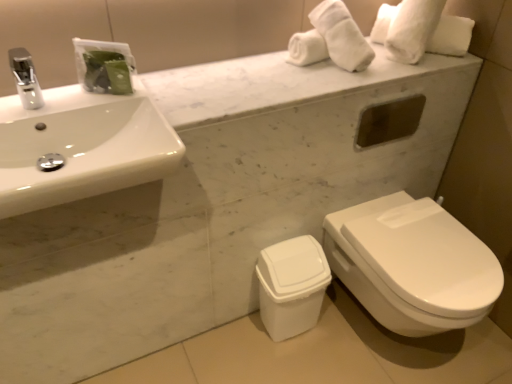
Question: Can you confirm if white glossy sink at upper left is bigger than silver metallic faucet at upper left?

Choices:
 (A) yes
 (B) no

Answer: (A)

Question: Does white glossy sink at upper left turn towards silver metallic faucet at upper left?

Choices:
 (A) no
 (B) yes

Answer: (A)

Question: Would you say white glossy sink at upper left is outside silver metallic faucet at upper left?

Choices:
 (A) yes
 (B) no

Answer: (A)

Question: Is white glossy sink at upper left further to camera compared to silver metallic faucet at upper left?

Choices:
 (A) yes
 (B) no

Answer: (B)

Question: From the image's perspective, is white glossy sink at upper left above silver metallic faucet at upper left?

Choices:
 (A) yes
 (B) no

Answer: (B)

Question: From a real-world perspective, relative to white glossy toilet at lower right, is white glossy sink at upper left vertically above or below?

Choices:
 (A) below
 (B) above

Answer: (B)

Question: From the image's perspective, relative to white glossy toilet at lower right, is white glossy sink at upper left above or below?

Choices:
 (A) below
 (B) above

Answer: (B)

Question: Considering their positions, is white glossy sink at upper left located in front of or behind white glossy toilet at lower right?

Choices:
 (A) behind
 (B) front

Answer: (B)

Question: In the image, is white glossy sink at upper left on the left side or the right side of white glossy toilet at lower right?

Choices:
 (A) right
 (B) left

Answer: (B)

Question: Is point (98, 107) positioned closer to the camera than point (278, 289)?

Choices:
 (A) farther
 (B) closer

Answer: (B)

Question: Considering their positions, is white glossy sink at upper left located in front of or behind white plastic trash can at lower center?

Choices:
 (A) behind
 (B) front

Answer: (B)

Question: From the image's perspective, is white glossy sink at upper left located above or below white plastic trash can at lower center?

Choices:
 (A) below
 (B) above

Answer: (B)

Question: Would you say white glossy sink at upper left is inside or outside white plastic trash can at lower center?

Choices:
 (A) outside
 (B) inside

Answer: (A)

Question: From the image's perspective, relative to white glossy sink at upper left, is silver metallic faucet at upper left above or below?

Choices:
 (A) below
 (B) above

Answer: (B)

Question: Is silver metallic faucet at upper left taller or shorter than white glossy sink at upper left?

Choices:
 (A) tall
 (B) short

Answer: (B)